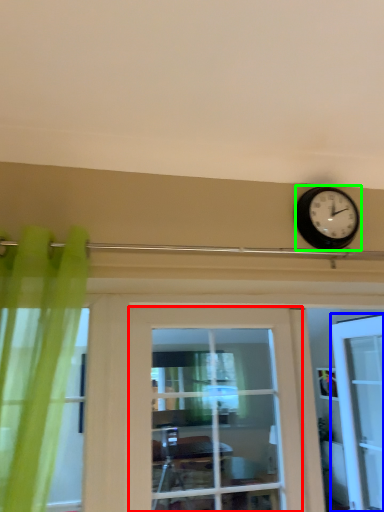
Question: Considering the real-world distances, which object is closest to door (highlighted by a red box)? door (highlighted by a blue box) or wall clock (highlighted by a green box).

Choices:
 (A) door
 (B) wall clock

Answer: (B)